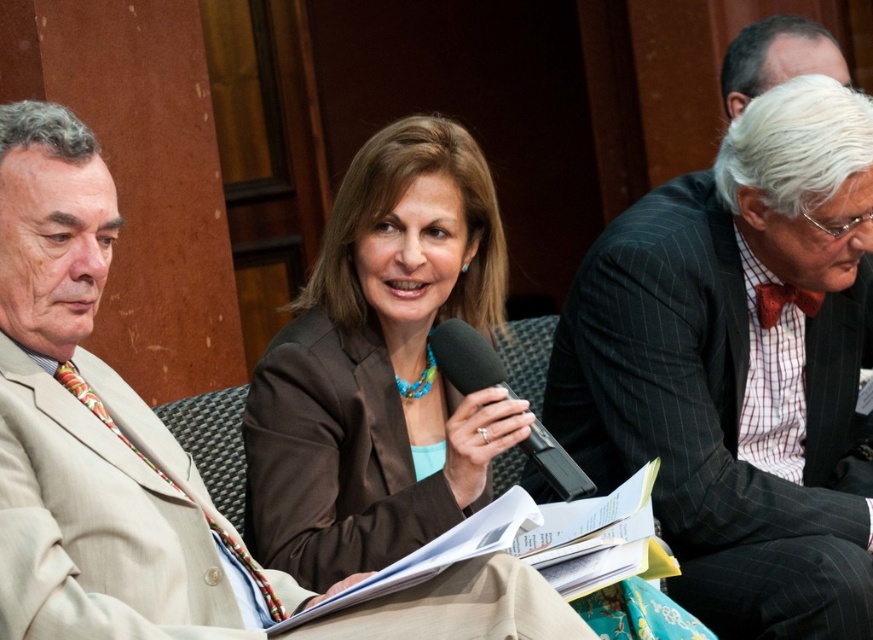
Question: Can you confirm if dark gray pinstripe suit at right is positioned to the right of black matte microphone at center?

Choices:
 (A) no
 (B) yes

Answer: (B)

Question: Which point is farther to the camera?

Choices:
 (A) (432, 352)
 (B) (162, 605)

Answer: (A)

Question: Is dark gray pinstripe suit at right bigger than black matte microphone at center?

Choices:
 (A) no
 (B) yes

Answer: (B)

Question: Which object is the farthest from the dark gray pinstripe suit at right?

Choices:
 (A) black matte microphone at center
 (B) beige textured suit at left

Answer: (B)

Question: Which of the following is the closest to the observer?

Choices:
 (A) beige textured suit at left
 (B) black matte microphone at center
 (C) dark gray pinstripe suit at right

Answer: (A)

Question: Does dark gray pinstripe suit at right appear under black matte microphone at center?

Choices:
 (A) yes
 (B) no

Answer: (B)